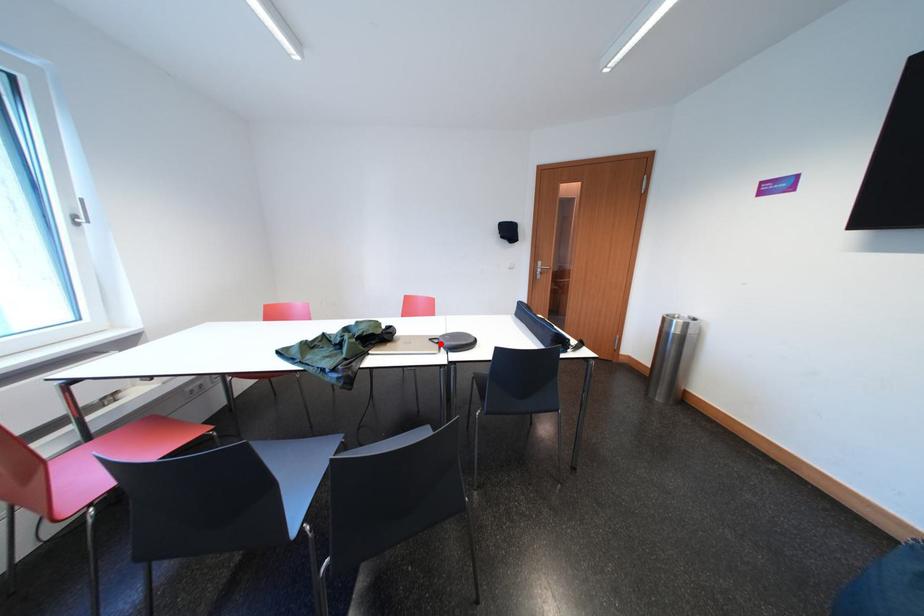
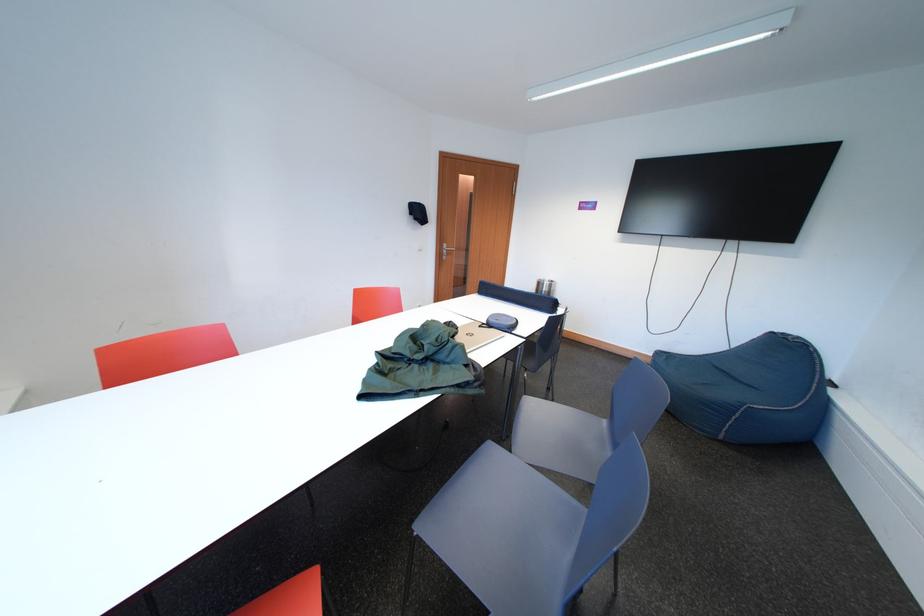
Where in the second image is the point corresponding to the highlighted location from the first image?

(490, 330)